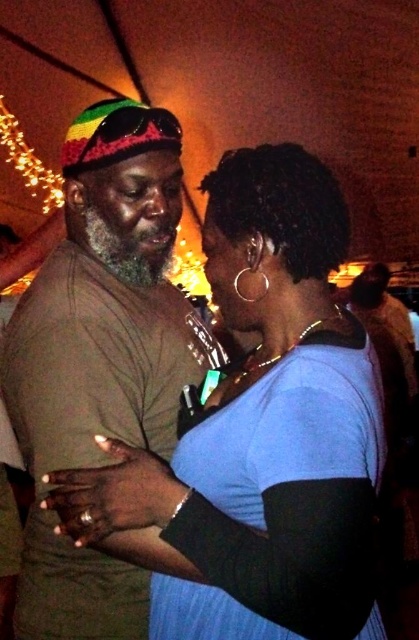
The height and width of the screenshot is (640, 419). Describe the element at coordinates (261, 432) in the screenshot. I see `blue matte shirt at center` at that location.

Who is more forward, (62, 522) or (93, 436)?

Point (62, 522) is in front.

Identify the location of blue matte shirt at center. (261, 432).